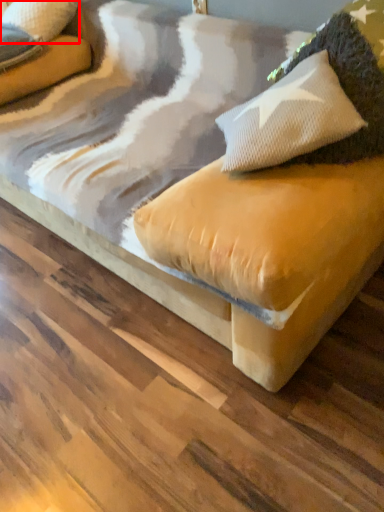
Question: In this image, where is pillow (annotated by the red box) located relative to pillow?

Choices:
 (A) right
 (B) left

Answer: (B)